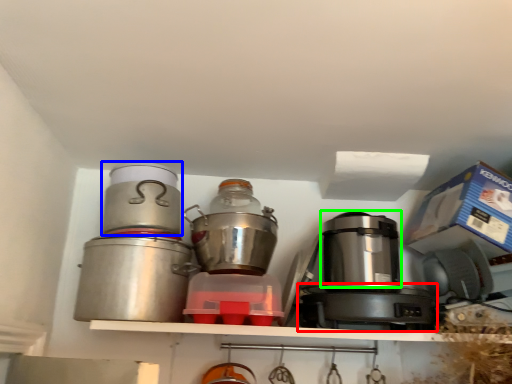
Question: Which object is positioned farthest from appliance (highlighted by a red box)? Select from kitchen appliance (highlighted by a blue box) and appliance (highlighted by a green box).

Choices:
 (A) kitchen appliance
 (B) appliance

Answer: (A)